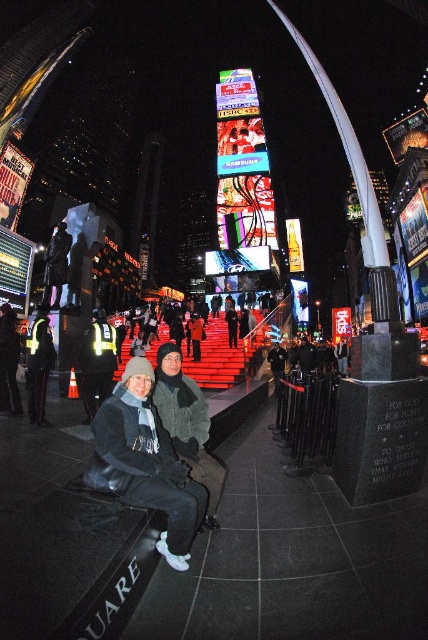
You are a photographer trying to capture a clear shot of the dark gray knit hat at lower center and the reflective yellow vest at lower left. Since you want both objects in focus, you need to know which one is wider. Can you determine which object is wider?

The dark gray knit hat at lower center might be wider than reflective yellow vest at lower left, so you should adjust your camera settings to ensure both are in focus considering the width difference.

You are a photographer standing at the edge of Times Square. You want to capture a photo of the dark gray knit hat at lower center and the nearest billboard advertisement. How far apart are these two objects?

The dark gray knit hat at lower center and the nearest billboard advertisement are 104.09 feet apart.